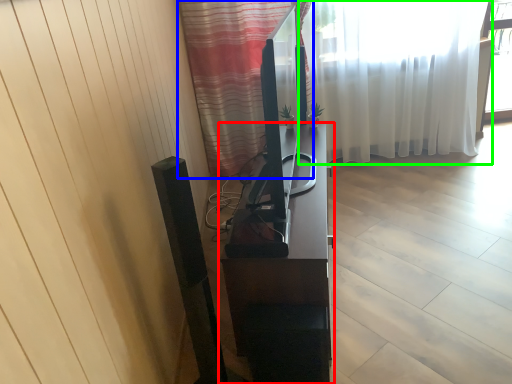
Question: Which object is positioned closest to furniture (highlighted by a red box)? Select from curtain (highlighted by a blue box) and curtain (highlighted by a green box).

Choices:
 (A) curtain
 (B) curtain

Answer: (A)